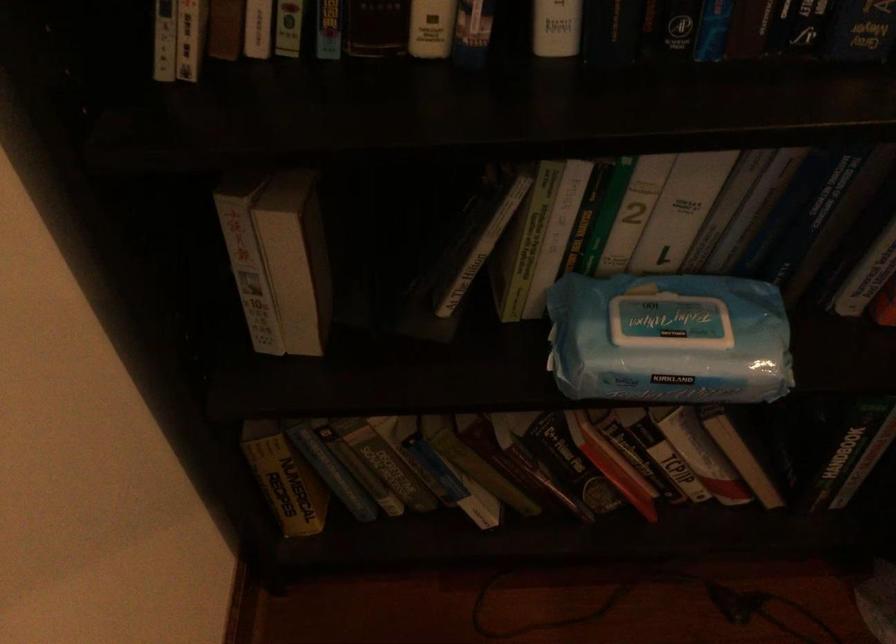
This screenshot has width=896, height=644. Describe the element at coordinates (610, 464) in the screenshot. I see `the red spine book` at that location.